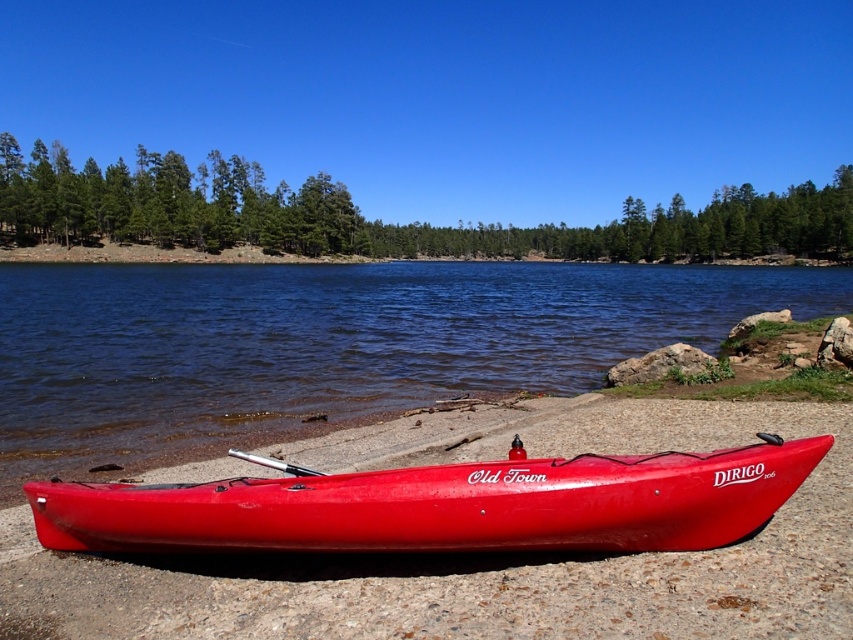
Question: Which of the following is the farthest from the observer?

Choices:
 (A) (234, 497)
 (B) (235, 452)
 (C) (553, 298)

Answer: (C)

Question: Which of the following is the closest to the observer?

Choices:
 (A) silver metallic paddle at center
 (B) glossy red kayak at lower center

Answer: (B)

Question: Can you confirm if glossy water at center is positioned below silver metallic paddle at center?

Choices:
 (A) yes
 (B) no

Answer: (B)

Question: Can you confirm if glossy water at center is wider than silver metallic paddle at center?

Choices:
 (A) no
 (B) yes

Answer: (B)

Question: Can you confirm if glossy water at center is bigger than silver metallic paddle at center?

Choices:
 (A) no
 (B) yes

Answer: (B)

Question: Estimate the real-world distances between objects in this image. Which object is farther from the glossy red kayak at lower center?

Choices:
 (A) silver metallic paddle at center
 (B) glossy water at center

Answer: (B)